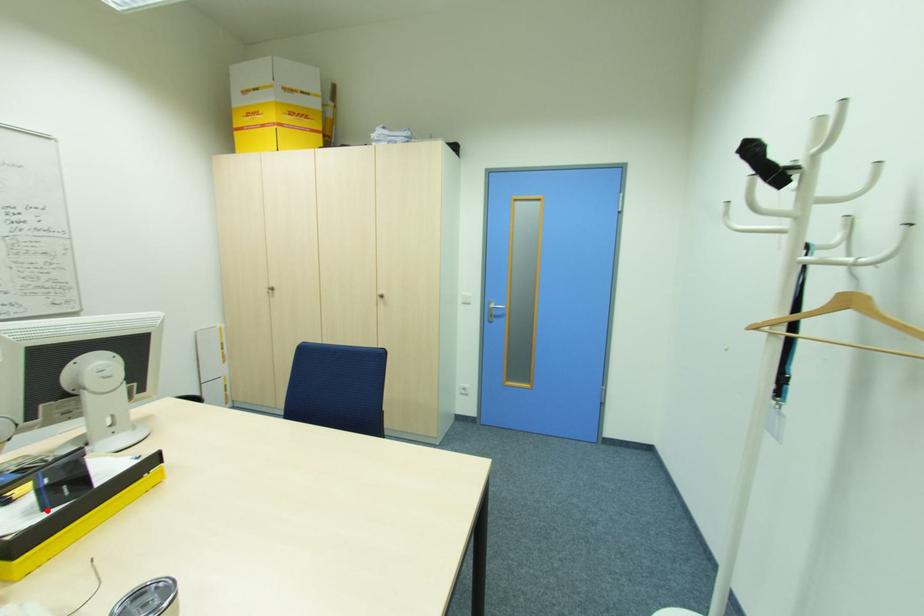
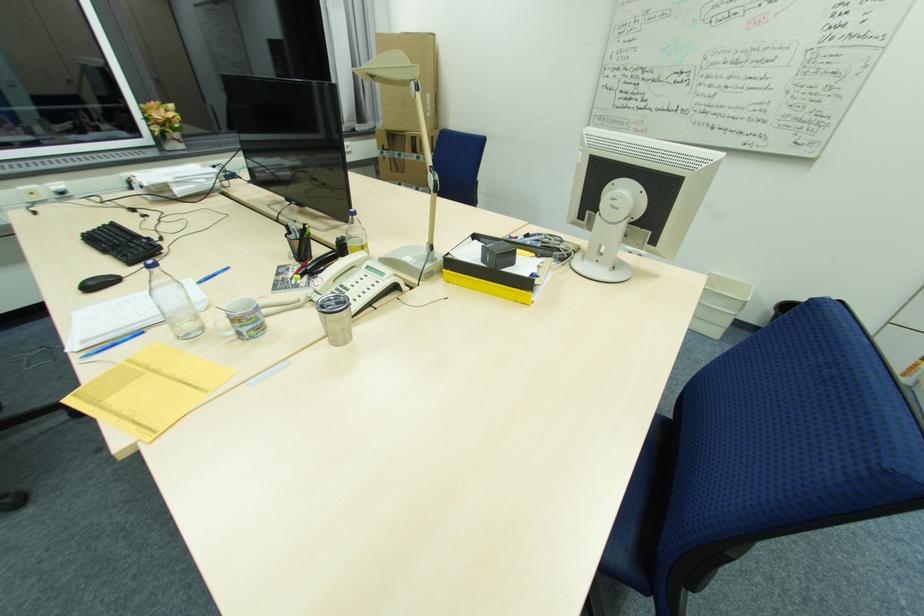
In the second image, find the point that corresponds to the highlighted location in the first image.

(484, 262)